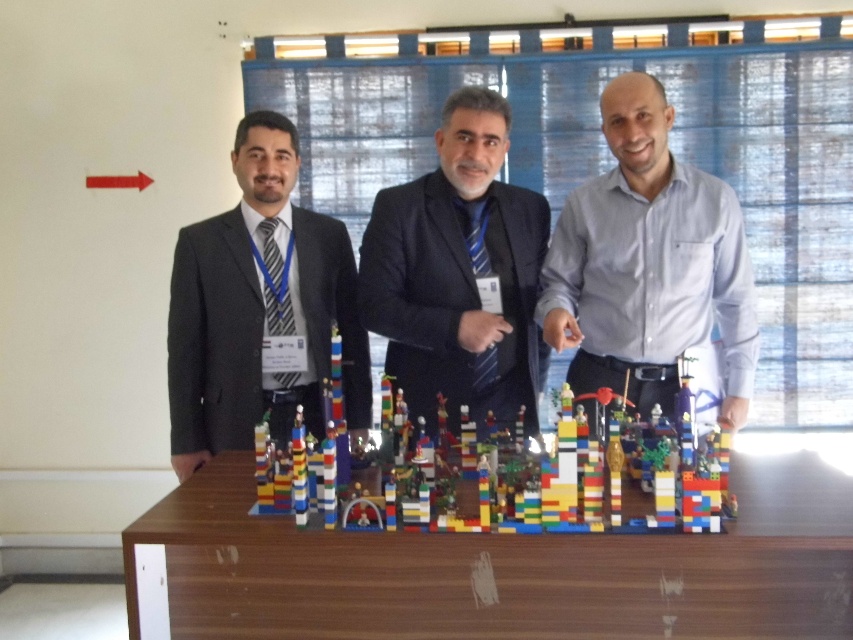
Based on the photo, measure the distance between dark gray suit at left and camera.

dark gray suit at left is 2.45 meters away from camera.

Is dark gray suit at left to the left of black matte suit at center from the viewer's perspective?

Correct, you'll find dark gray suit at left to the left of black matte suit at center.

What do you see at coordinates (260, 308) in the screenshot? This screenshot has height=640, width=853. I see `dark gray suit at left` at bounding box center [260, 308].

The height and width of the screenshot is (640, 853). Find the location of `dark gray suit at left`. dark gray suit at left is located at coordinates point(260,308).

Is light blue shirt at center smaller than black matte suit at center?

Incorrect, light blue shirt at center is not smaller in size than black matte suit at center.

Is point (613, 237) positioned after point (395, 227)?

That is True.

At what (x,y) coordinates should I click in order to perform the action: click on light blue shirt at center. Please return your answer as a coordinate pair (x, y). Looking at the image, I should click on (648, 264).

Looking at this image, does dark gray suit at left come in front of multicolored plastic blocks at center?

That is False.

Is point (242, 160) positioned before point (521, 460)?

No, it is not.

The width and height of the screenshot is (853, 640). Identify the location of dark gray suit at left. (260, 308).